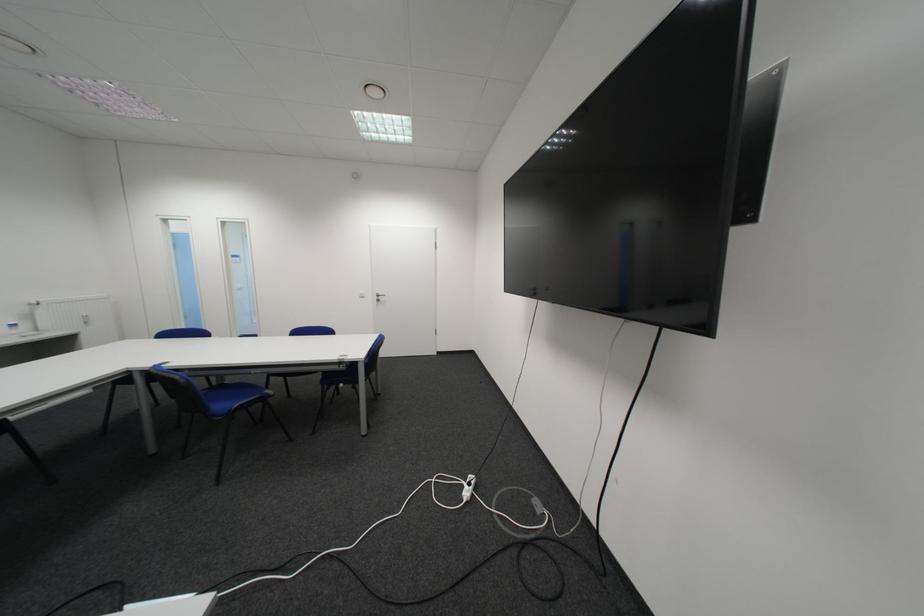
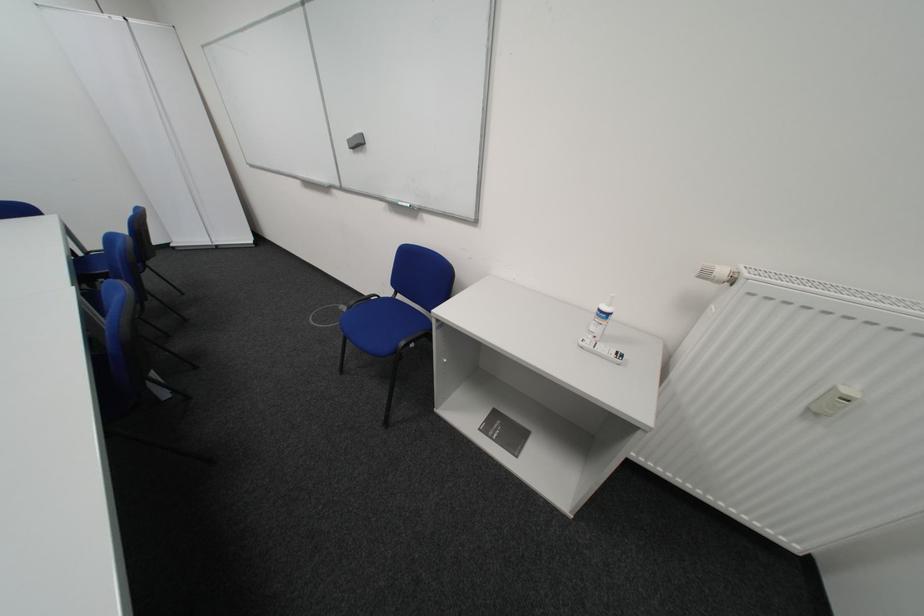
In the second image, find the point that corresponds to [38,336] in the first image.

(599, 345)